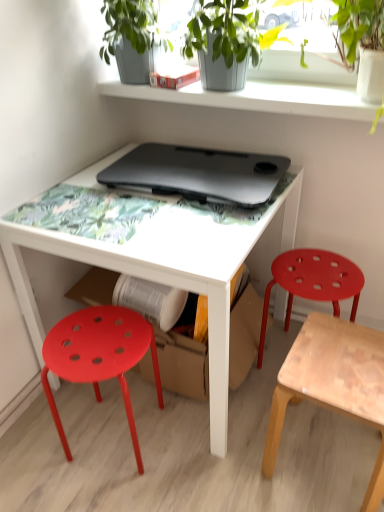
The height and width of the screenshot is (512, 384). In order to click on vacant space that is to the left of light brown wooden stool at lower right, marked as the 2th stool in a left-to-right arrangement in this screenshot , I will do `click(226, 460)`.